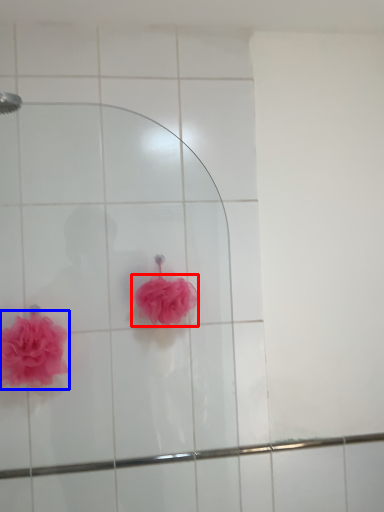
Question: Which object is further to the camera taking this photo, flower (highlighted by a red box) or flower (highlighted by a blue box)?

Choices:
 (A) flower
 (B) flower

Answer: (A)